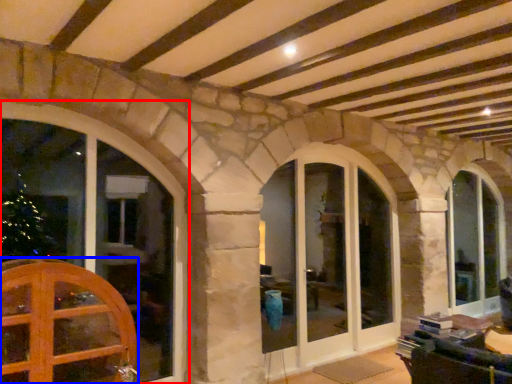
Question: Which object is closer to the camera taking this photo, window (highlighted by a red box) or door (highlighted by a blue box)?

Choices:
 (A) window
 (B) door

Answer: (B)